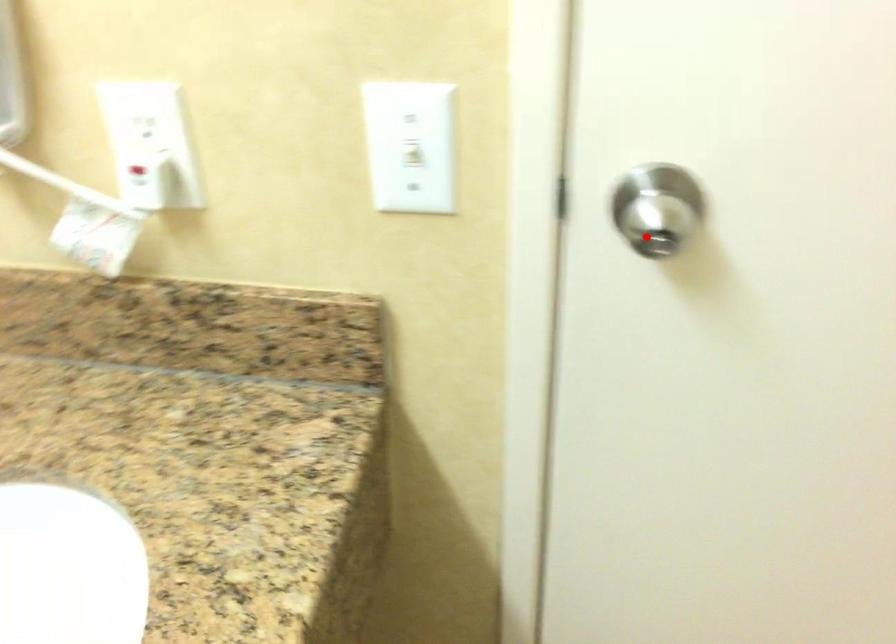
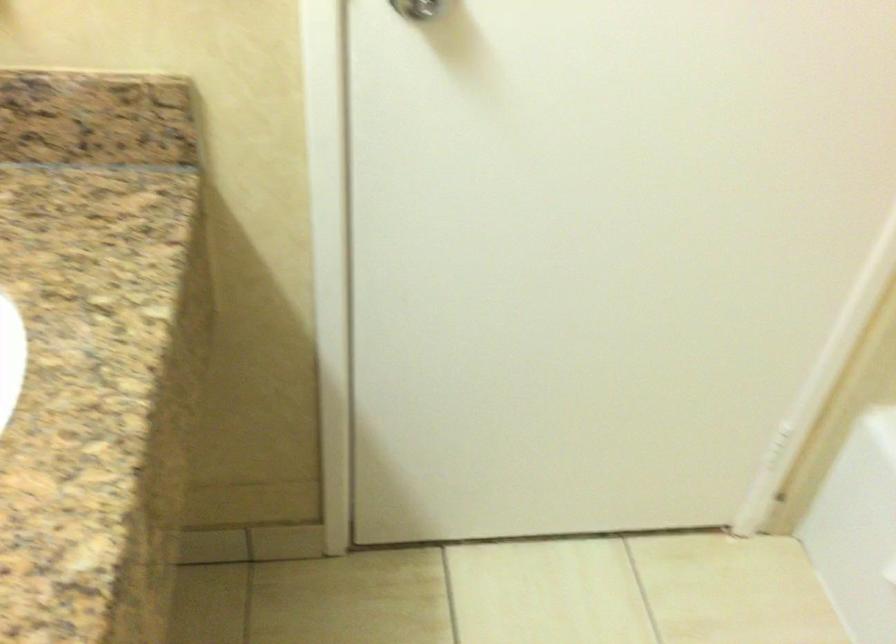
Question: I am providing you with two images of the same scene from different viewpoints. Image1 has a red point marked. In image2, the corresponding 3D location appears at what relative position? Reply with the corresponding letter.

Choices:
 (A) Closer
 (B) Farther

Answer: (B)